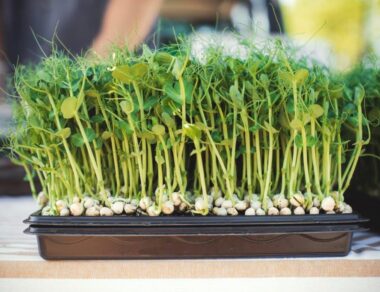
In order to click on brown tray in this screenshot , I will do `click(263, 237)`.